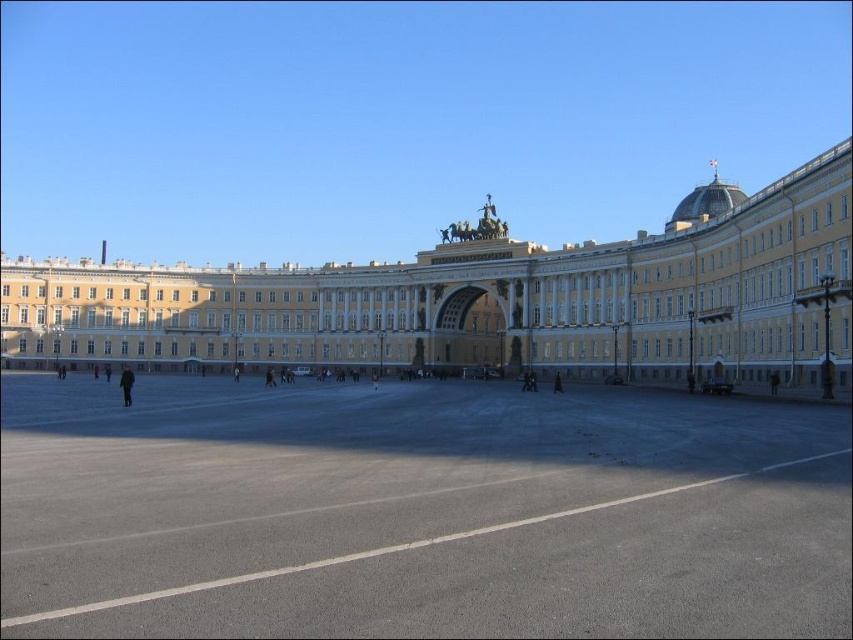
Does gray asphalt at center come in front of white stone building at center?

That is True.

Between gray asphalt at center and white stone building at center, which one is positioned lower?

gray asphalt at center

In order to click on gray asphalt at center in this screenshot , I will do `click(416, 512)`.